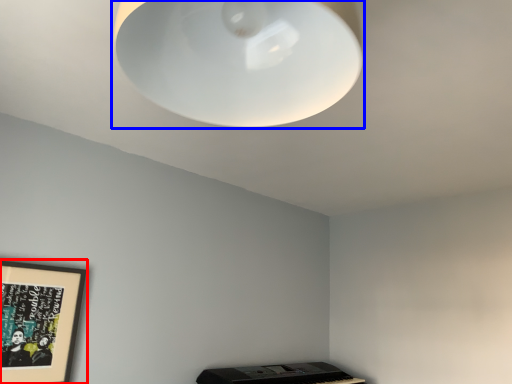
Question: Which of the following is the farthest to the observer, picture frame (highlighted by a red box) or lamp (highlighted by a blue box)?

Choices:
 (A) picture frame
 (B) lamp

Answer: (A)